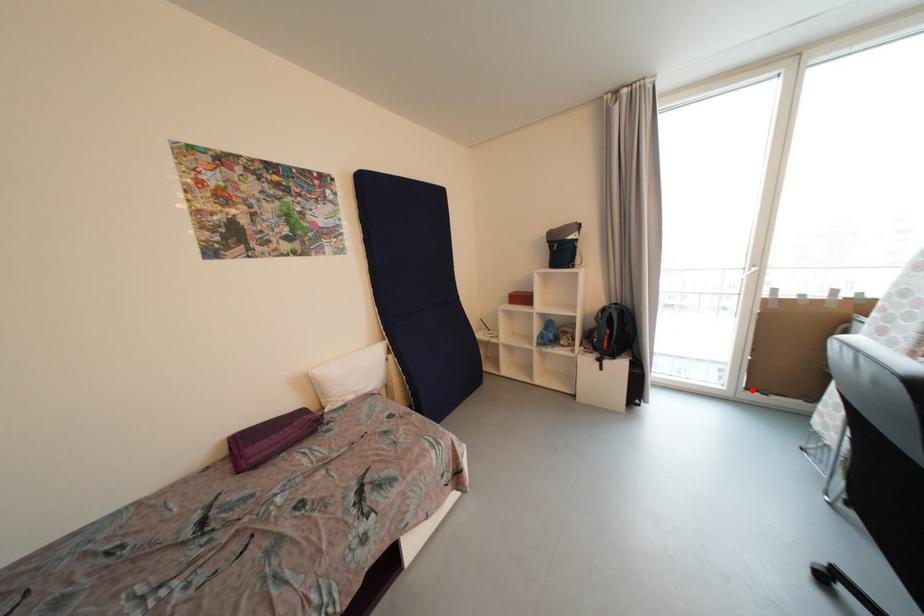
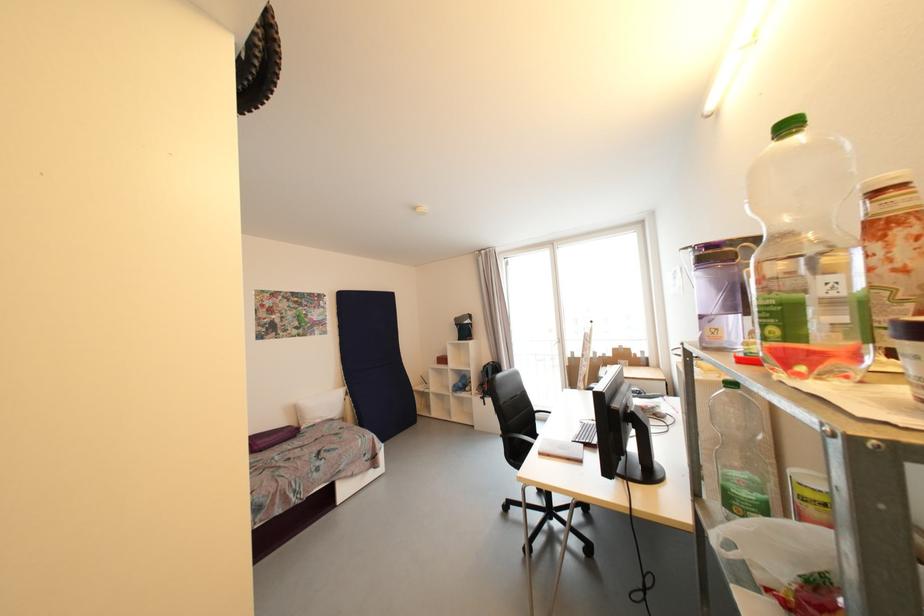
Question: I am providing you with two images of the same scene from different viewpoints. A red point is marked on the first image. Is the red point's position out of view in image 2?

Choices:
 (A) Yes
 (B) No

Answer: (A)